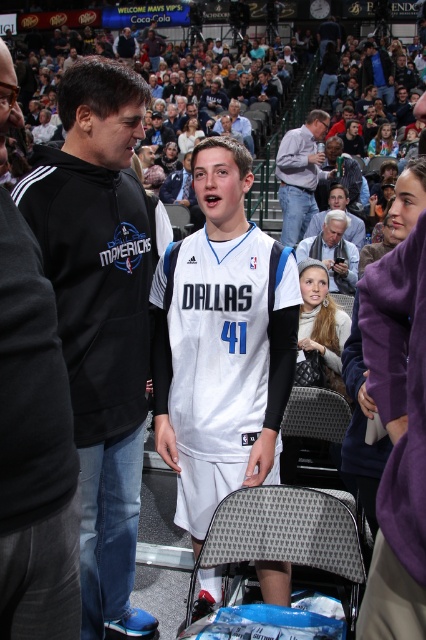
Can you confirm if black fleece hoodie at left is taller than light brown leather jacket at upper center?

Correct, black fleece hoodie at left is much taller as light brown leather jacket at upper center.

Find the location of a particular element. black fleece hoodie at left is located at coordinates (100, 316).

Identify the location of black fleece hoodie at left. The image size is (426, 640). (100, 316).

Can you confirm if gray fabric jacket at center is positioned to the left of dark gray hoodie at center?

Correct, you'll find gray fabric jacket at center to the left of dark gray hoodie at center.

Is gray fabric jacket at center further to camera compared to dark gray hoodie at center?

No.

Where is `gray fabric jacket at center`? The image size is (426, 640). gray fabric jacket at center is located at coordinates (333, 252).

You are a GUI agent. You are given a task and a screenshot of the screen. Output one action in this format:
    pyautogui.click(x=<x>, y=<y>)
    Task: Click on the gray fabric jacket at center
    
    Given the screenshot: What is the action you would take?
    pyautogui.click(x=333, y=252)

Is light brown leather jacket at upper center above dark blue hoodie at upper left?

No, light brown leather jacket at upper center is not above dark blue hoodie at upper left.

Which is below, light brown leather jacket at upper center or dark blue hoodie at upper left?

light brown leather jacket at upper center is below.

Who is more forward, (230, 122) or (129, 51)?

A: Point (230, 122) is more forward.

Where is `light brown leather jacket at upper center`? Image resolution: width=426 pixels, height=640 pixels. light brown leather jacket at upper center is located at coordinates (241, 124).